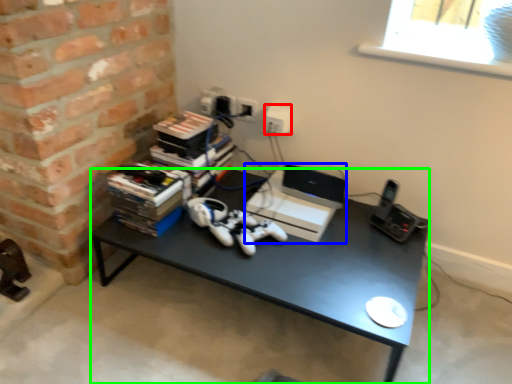
Question: Based on their relative distances, which object is farther from electric outlet (highlighted by a red box)? Choose from computer (highlighted by a blue box) and desk (highlighted by a green box).

Choices:
 (A) computer
 (B) desk

Answer: (B)